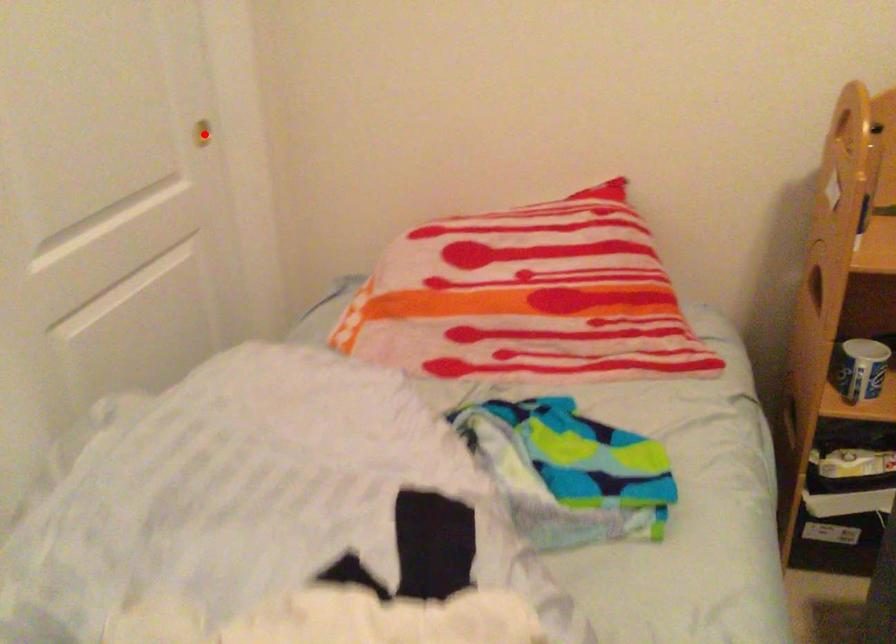
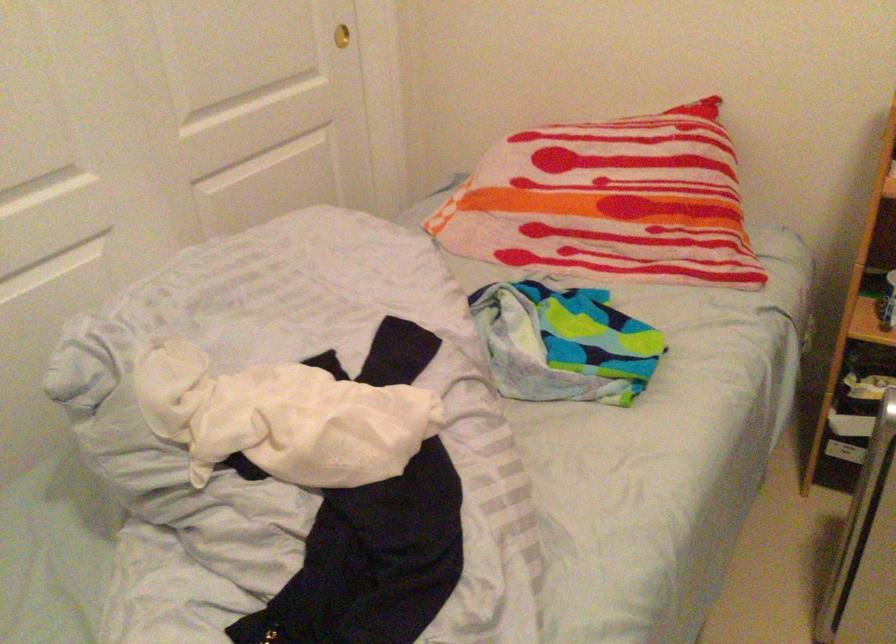
Question: I am providing you with two images of the same scene from different viewpoints. A red point is shown in image1. For the corresponding object point in image2, is it positioned nearer or farther from the camera?

Choices:
 (A) Nearer
 (B) Farther

Answer: (B)